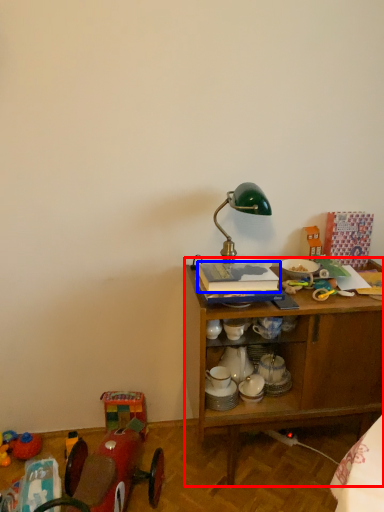
Question: Among these objects, which one is farthest to the camera, desk (highlighted by a red box) or book (highlighted by a blue box)?

Choices:
 (A) desk
 (B) book

Answer: (A)